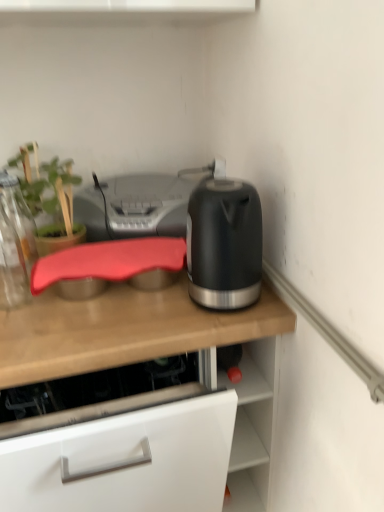
Question: Can you confirm if matte wooden countertop at center is shorter than matte black kettle at right?

Choices:
 (A) yes
 (B) no

Answer: (B)

Question: Is matte wooden countertop at center outside of matte black kettle at right?

Choices:
 (A) yes
 (B) no

Answer: (A)

Question: Can you confirm if matte wooden countertop at center is positioned to the right of matte black kettle at right?

Choices:
 (A) no
 (B) yes

Answer: (A)

Question: Does matte wooden countertop at center have a lesser width compared to matte black kettle at right?

Choices:
 (A) no
 (B) yes

Answer: (A)

Question: Considering the relative sizes of matte wooden countertop at center and matte black kettle at right in the image provided, is matte wooden countertop at center bigger than matte black kettle at right?

Choices:
 (A) no
 (B) yes

Answer: (B)

Question: Is matte black kettle at right located within matte wooden countertop at center?

Choices:
 (A) no
 (B) yes

Answer: (A)

Question: Can we say matte black kettle at right lies outside transparent glass bottle at left?

Choices:
 (A) no
 (B) yes

Answer: (B)

Question: From a real-world perspective, is matte black kettle at right positioned over transparent glass bottle at left based on gravity?

Choices:
 (A) yes
 (B) no

Answer: (A)

Question: Can you confirm if matte black kettle at right is thinner than transparent glass bottle at left?

Choices:
 (A) yes
 (B) no

Answer: (A)

Question: Does matte black kettle at right have a smaller size compared to transparent glass bottle at left?

Choices:
 (A) yes
 (B) no

Answer: (B)

Question: From the image's perspective, is matte black kettle at right on transparent glass bottle at left?

Choices:
 (A) yes
 (B) no

Answer: (B)

Question: Is matte black kettle at right in front of transparent glass bottle at left?

Choices:
 (A) yes
 (B) no

Answer: (A)

Question: Can you confirm if silver metallic printer at center is smaller than matte wooden countertop at center?

Choices:
 (A) yes
 (B) no

Answer: (A)